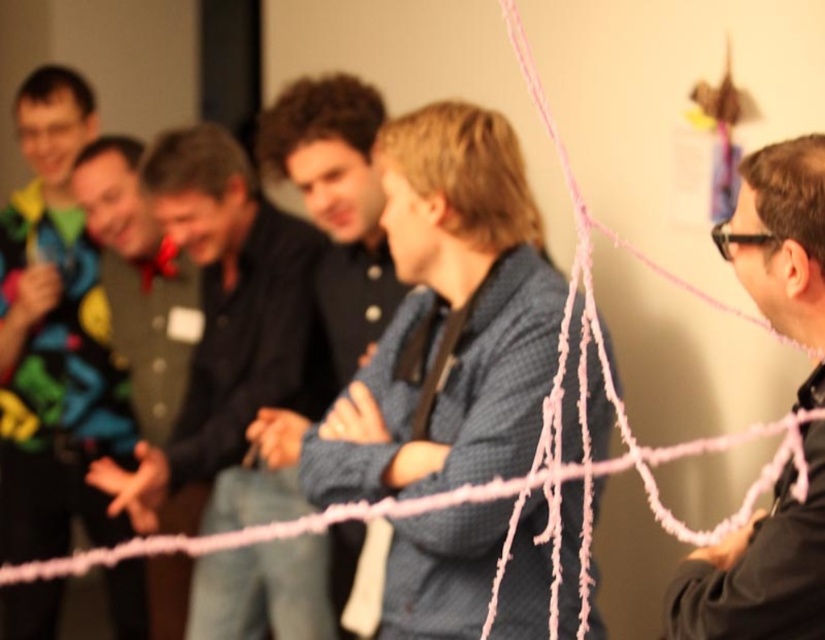
You are a photographer trying to capture a clear shot of the dark blue shirt at center without the multicolored fabric vest at left blocking it. Based on their positions, is it possible to adjust your angle to avoid the vest?

The multicolored fabric vest at left is located above the dark blue shirt at center, so if you lower your camera angle slightly, you can position it below the vest to capture the shirt without obstruction.

You are organizing a small party and want to place a decorative item at point (x=54, y=337). The multicolored fabric vest at left is already there. Can you place another item next to it without overlapping?

The multicolored fabric vest at left is located at point (x=54, y=337). Since the question allows placing an item next to it without overlapping, yes, you can place another item nearby as long as it doesn not occupy the exact coordinates.

Based on the photo, you are standing in the room and see two points marked in the image. Which point is nearer to you, point (x=442, y=364) or point (x=171, y=609)?

Point (x=442, y=364) is closer to the viewer than point (x=171, y=609).